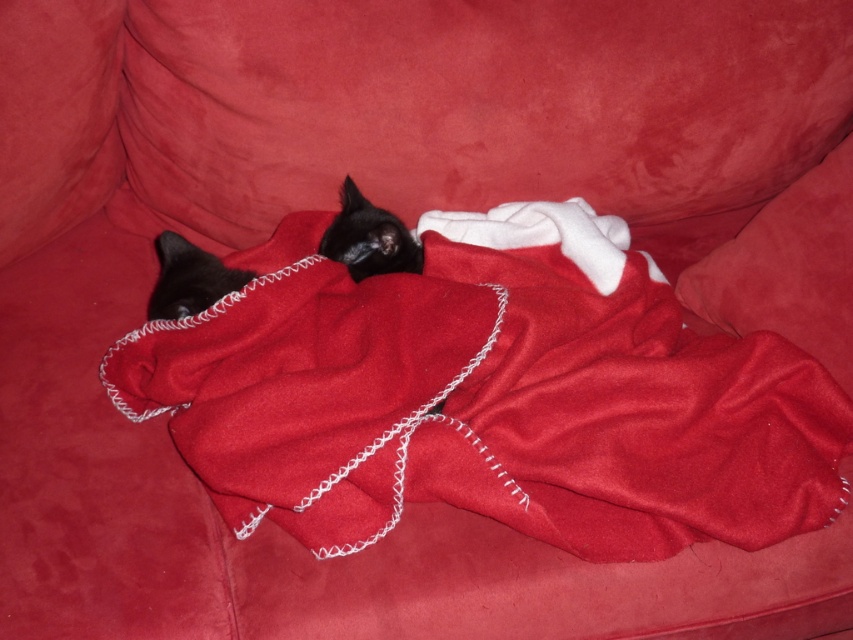
Which is below, black matte fur cat at center or matte black cat at left?

Positioned lower is matte black cat at left.

Can you confirm if black matte fur cat at center is thinner than matte black cat at left?

No, black matte fur cat at center is not thinner than matte black cat at left.

Find the location of a particular element. The width and height of the screenshot is (853, 640). black matte fur cat at center is located at coordinates (368, 237).

Is the position of velvet cushion at center less distant than that of black matte fur cat at center?

Yes, it is.

Locate an element on the screen. The height and width of the screenshot is (640, 853). velvet cushion at center is located at coordinates (788, 268).

Is velvet cushion at center bigger than matte black cat at left?

Indeed, velvet cushion at center has a larger size compared to matte black cat at left.

Between point (808, 282) and point (177, 244), which one is positioned behind?

Positioned behind is point (177, 244).

In order to click on velvet cushion at center in this screenshot , I will do `click(788, 268)`.